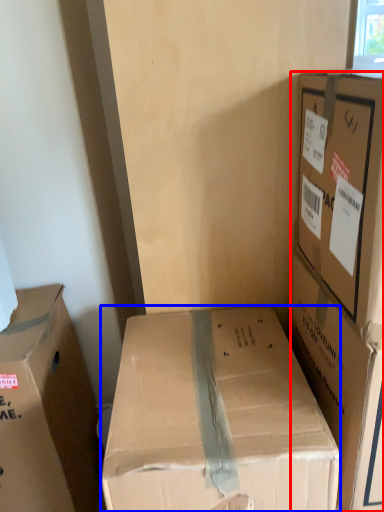
Question: Which object is closer to the camera taking this photo, box (highlighted by a red box) or box (highlighted by a blue box)?

Choices:
 (A) box
 (B) box

Answer: (B)